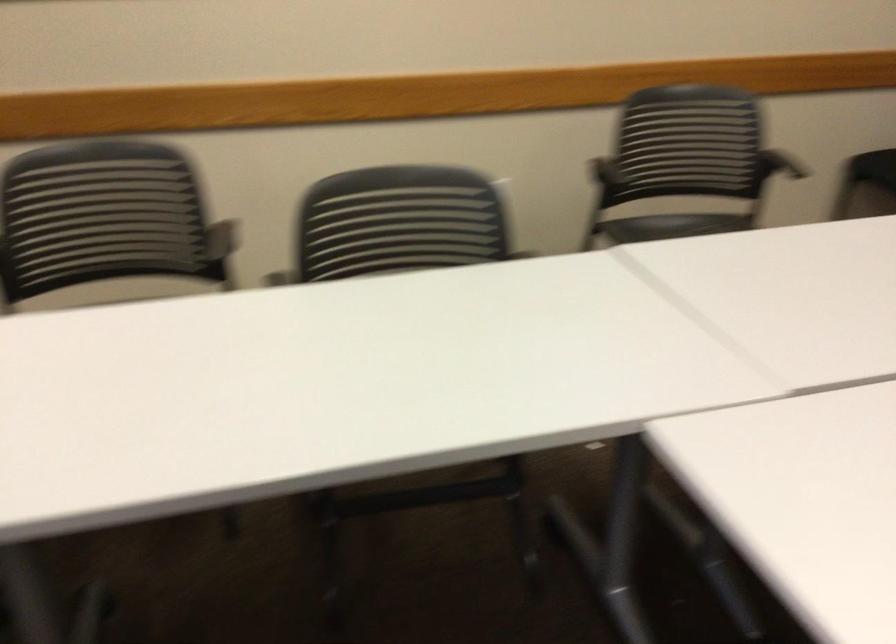
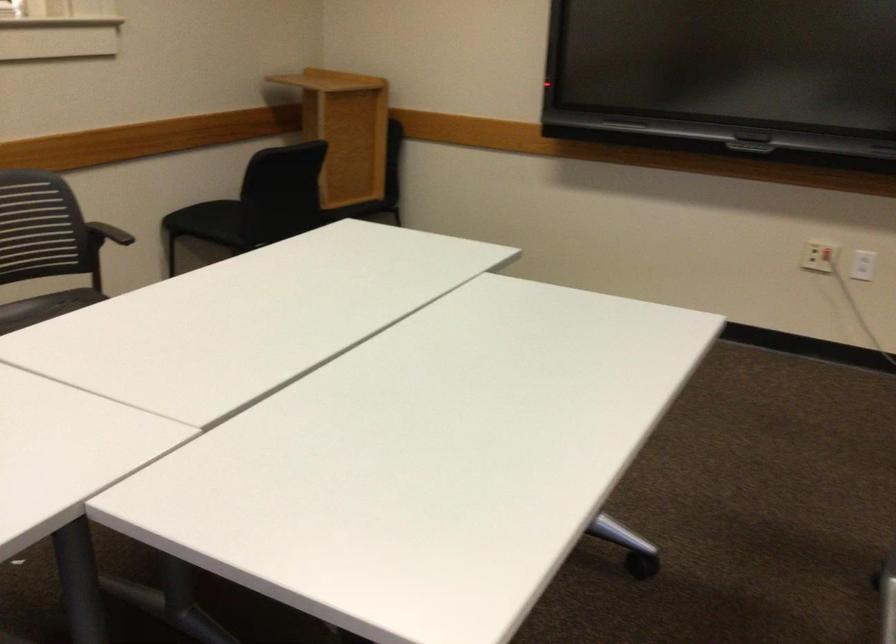
Question: The camera is either moving clockwise (left) or counter-clockwise (right) around the object. The first image is from the beginning of the video and the second image is from the end. Is the camera moving left or right when shooting the video?

Choices:
 (A) Left
 (B) Right

Answer: (A)